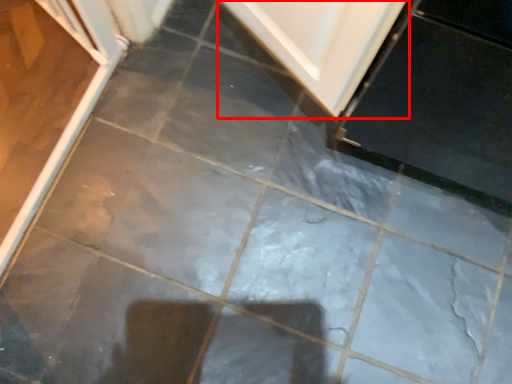
Question: From the image's perspective, considering the relative positions of door (annotated by the red box) and screen door in the image provided, where is door (annotated by the red box) located with respect to the staircase?

Choices:
 (A) above
 (B) below

Answer: (A)